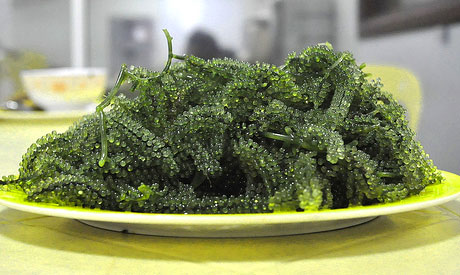
The image size is (460, 275). Find the location of `table on foreground`. table on foreground is located at coordinates (101, 256).